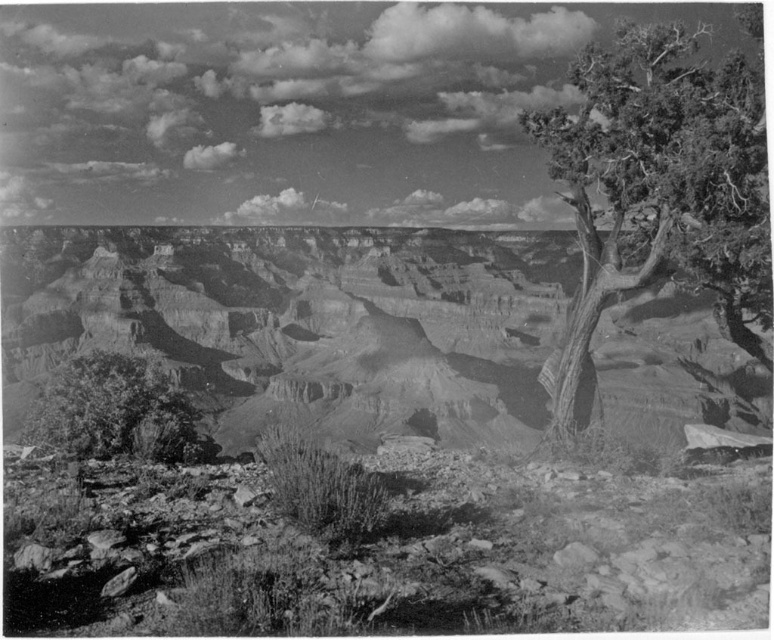
Question: Among these points, which one is farthest from the camera?

Choices:
 (A) (461, 275)
 (B) (574, 70)

Answer: (A)

Question: Among these points, which one is nearest to the camera?

Choices:
 (A) (84, 419)
 (B) (574, 429)
 (C) (2, 362)

Answer: (A)

Question: From the image, what is the correct spatial relationship of rugged rock canyon at center in relation to grainy gray tree at lower left?

Choices:
 (A) above
 (B) below

Answer: (A)

Question: In this image, where is green textured tree at right located relative to grainy gray tree at lower left?

Choices:
 (A) right
 (B) left

Answer: (A)

Question: Observing the image, what is the correct spatial positioning of rugged rock canyon at center in reference to grainy gray tree at lower left?

Choices:
 (A) above
 (B) below

Answer: (A)

Question: Which object appears closest to the camera in this image?

Choices:
 (A) rugged rock canyon at center
 (B) green textured tree at right
 (C) grainy gray tree at lower left

Answer: (B)